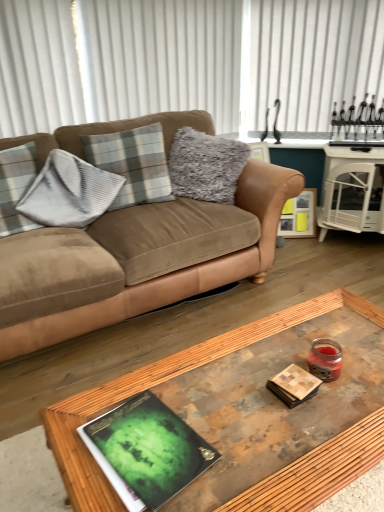
The image size is (384, 512). What do you see at coordinates (352, 190) in the screenshot?
I see `white glossy side table at right` at bounding box center [352, 190].

This screenshot has height=512, width=384. Describe the element at coordinates (294, 385) in the screenshot. I see `matte brown book at center` at that location.

This screenshot has height=512, width=384. Describe the element at coordinates (160, 383) in the screenshot. I see `wooden glass coffee table at center` at that location.

How much space does plaid fabric pillow at center, positioned as the 1th pillow in right-to-left order, occupy horizontally?

The width of plaid fabric pillow at center, positioned as the 1th pillow in right-to-left order, is 9.28 inches.

This screenshot has height=512, width=384. Find the location of `suede brown couch at upper left`. suede brown couch at upper left is located at coordinates (136, 260).

Is point (299, 397) positioned behind point (209, 269)?

That is False.

From the image's perspective, is matte brown book at center over suede brown couch at upper left?

No, from the image's perspective, matte brown book at center is not over suede brown couch at upper left.

From a real-world perspective, is matte brown book at center on top of suede brown couch at upper left?

Incorrect, from a real-world perspective, matte brown book at center is lower than suede brown couch at upper left.

Is matte brown book at center wider or thinner than suede brown couch at upper left?

Considering their sizes, matte brown book at center looks slimmer than suede brown couch at upper left.

Is gray plaid pillow at left, the first pillow when ordered from left to right, next to green matte book at center and touching it?

gray plaid pillow at left, the first pillow when ordered from left to right, is not next to green matte book at center, and they're not touching.

Considering the positions of objects gray plaid pillow at left, the second pillow when ordered from right to left, and green matte book at center in the image provided, who is more to the right, gray plaid pillow at left, the second pillow when ordered from right to left, or green matte book at center?

From the viewer's perspective, green matte book at center appears more on the right side.

Does point (5, 186) appear closer or farther from the camera than point (90, 431)?

Point (5, 186) appears to be farther away from the viewer than point (90, 431).

Looking at this image, is wooden picture frame at right oriented away from gray plaid pillow at left, the first pillow when ordered from left to right?

No, gray plaid pillow at left, the first pillow when ordered from left to right, is not at the back of wooden picture frame at right.

Is wooden picture frame at right at the left side of gray plaid pillow at left, the second pillow when ordered from right to left?

No.

Relative to gray plaid pillow at left, the first pillow when ordered from left to right, is wooden picture frame at right in front or behind?

wooden picture frame at right is positioned farther from the viewer than gray plaid pillow at left, the first pillow when ordered from left to right.

In the image, is green matte book at center on the left side or the right side of matte brown book at center?

green matte book at center is to the left of matte brown book at center.

Is green matte book at center spatially inside matte brown book at center, or outside of it?

green matte book at center is not inside matte brown book at center, it's outside.

From a real-world perspective, is green matte book at center over matte brown book at center?

Incorrect, from a real-world perspective, green matte book at center is lower than matte brown book at center.

Looking at the image, does green matte book at center seem bigger or smaller compared to matte brown book at center?

Considering their sizes, green matte book at center takes up more space than matte brown book at center.

Which object is further away from the camera, suede brown couch at upper left or white glossy side table at right?

white glossy side table at right.

Is suede brown couch at upper left far away from white glossy side table at right?

Indeed, suede brown couch at upper left is not near white glossy side table at right.

From a real-world perspective, which is physically above, suede brown couch at upper left or white glossy side table at right?

suede brown couch at upper left, from a real-world perspective.

Locate an element on the screen. table beneath the suede brown couch at upper left (from a real-world perspective) is located at coordinates (352, 190).

Is suede brown couch at upper left looking in the opposite direction of matte brown book at center?

suede brown couch at upper left is not turned away from matte brown book at center.

Can we say suede brown couch at upper left lies outside matte brown book at center?

Yes, suede brown couch at upper left is located beyond the bounds of matte brown book at center.

From the image's perspective, would you say suede brown couch at upper left is shown under matte brown book at center?

No, from the image's perspective, suede brown couch at upper left is not beneath matte brown book at center.

Is point (161, 303) more distant than point (299, 371)?

Yes, point (161, 303) is farther from viewer.

From the image's perspective, which object appears higher, wooden glass coffee table at center or white glossy side table at right?

white glossy side table at right is shown above in the image.

What's the angular difference between wooden glass coffee table at center and white glossy side table at right's facing directions?

40.9 degrees separate the facing orientations of wooden glass coffee table at center and white glossy side table at right.

Considering the points (198, 362) and (329, 149), which point is behind, point (198, 362) or point (329, 149)?

Point (329, 149)

Which of these two, wooden glass coffee table at center or white glossy side table at right, is wider?

With larger width is wooden glass coffee table at center.

At what (x,y) coordinates should I click in order to perform the action: click on book in front of the suede brown couch at upper left. Please return your answer as a coordinate pair (x, y). The height and width of the screenshot is (512, 384). Looking at the image, I should click on point(294,385).

Identify the location of magazine on the right side of gray plaid pillow at left, the first pillow when ordered from left to right. (146, 451).

When comparing their distances from plaid fabric pillow at center, arranged as the 2th pillow when viewed from the left, does wooden picture frame at right or green matte book at center seem closer?

wooden picture frame at right.

Estimate the real-world distances between objects in this image. Which object is closer to green matte book at center, wooden picture frame at right or matte brown book at center?

The object closer to green matte book at center is matte brown book at center.

Looking at this image, from the image, which object appears to be nearer to wooden picture frame at right, matte brown book at center or white glossy side table at right?

white glossy side table at right is positioned closer to the anchor wooden picture frame at right.

Considering their positions, is suede brown couch at upper left positioned further to white glossy side table at right than green matte book at center?

green matte book at center lies further to white glossy side table at right than the other object.

Looking at the image, which one is located closer to matte brown book at center, gray plaid pillow at left, the second pillow when ordered from right to left, or plaid fabric pillow at center, arranged as the 2th pillow when viewed from the left?

plaid fabric pillow at center, arranged as the 2th pillow when viewed from the left, is closer to matte brown book at center.

When comparing their distances from wooden picture frame at right, does white glossy side table at right or suede brown couch at upper left seem further?

The object further to wooden picture frame at right is suede brown couch at upper left.

Based on their spatial positions, is green matte book at center or matte brown book at center further from gray plaid pillow at left, the first pillow when ordered from left to right?

matte brown book at center is further to gray plaid pillow at left, the first pillow when ordered from left to right.

From the image, which object appears to be nearer to white glossy side table at right, matte brown book at center or wooden glass coffee table at center?

wooden glass coffee table at center lies closer to white glossy side table at right than the other object.

I want to click on magazine between wooden glass coffee table at center and wooden picture frame at right along the z-axis, so click(x=146, y=451).

Where is `book between suede brown couch at upper left and white glossy side table at right in the horizontal direction`? The image size is (384, 512). book between suede brown couch at upper left and white glossy side table at right in the horizontal direction is located at coordinates (294, 385).

The image size is (384, 512). Identify the location of book positioned between green matte book at center and plaid fabric pillow at center, arranged as the 2th pillow when viewed from the left, from near to far. (294, 385).

This screenshot has height=512, width=384. Identify the location of picture frame between gray plaid pillow at left, the second pillow when ordered from right to left, and white glossy side table at right, in the horizontal direction. (299, 216).